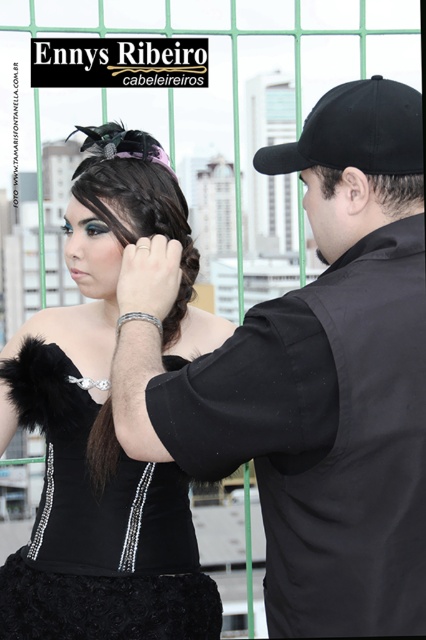
Looking at this image, is satin dark brown hair at center taller than black matte baseball cap at upper right?

Yes, satin dark brown hair at center is taller than black matte baseball cap at upper right.

Does satin dark brown hair at center appear over black matte baseball cap at upper right?

No.

The width and height of the screenshot is (426, 640). In order to click on satin dark brown hair at center in this screenshot , I will do `click(141, 211)`.

Locate an element on the screen. satin dark brown hair at center is located at coordinates point(141,211).

Does black matte baseball cap at upper right have a greater height compared to dark brown hair at center?

Indeed, black matte baseball cap at upper right has a greater height compared to dark brown hair at center.

Consider the image. Between black matte baseball cap at upper right and dark brown hair at center, which one has less height?

With less height is dark brown hair at center.

Where is `black matte baseball cap at upper right`? black matte baseball cap at upper right is located at coordinates (356, 131).

Can you confirm if black matte vest at center is wider than black matte baseball cap at upper right?

Correct, the width of black matte vest at center exceeds that of black matte baseball cap at upper right.

Locate an element on the screen. black matte vest at center is located at coordinates (310, 381).

Which is behind, point (371, 579) or point (374, 76)?

The point (374, 76) is more distant.

You are a GUI agent. You are given a task and a screenshot of the screen. Output one action in this format:
    pyautogui.click(x=<x>, y=<y>)
    Task: Click on the black matte vest at center
    The height and width of the screenshot is (640, 426).
    Given the screenshot: What is the action you would take?
    pyautogui.click(x=310, y=381)